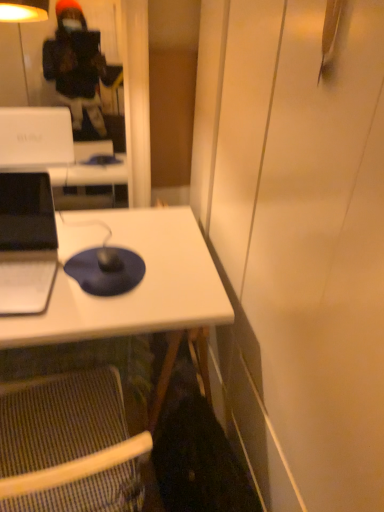
Image resolution: width=384 pixels, height=512 pixels. What are the coordinates of `free spot to the right of matte black laptop at left` in the screenshot? It's located at (79, 306).